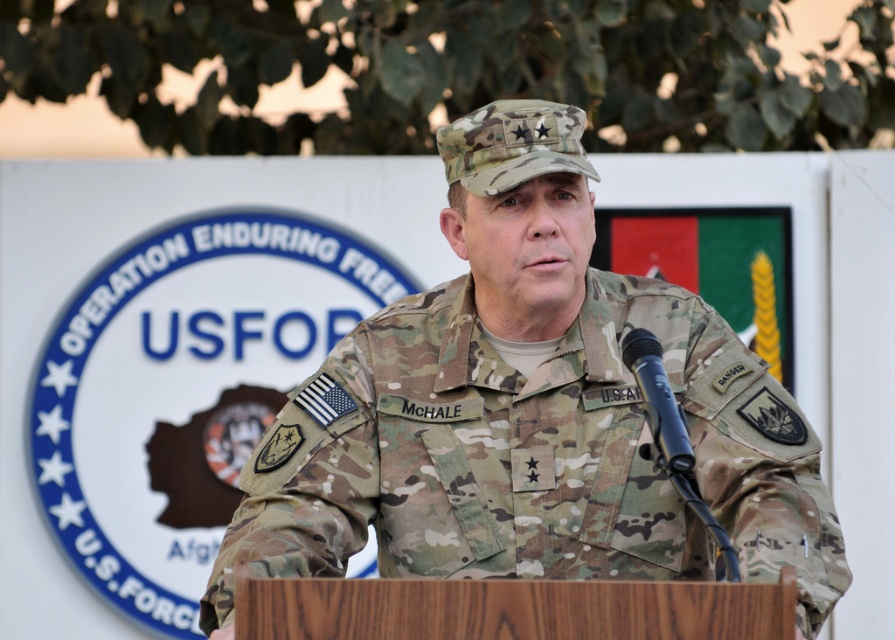
Question: Does camo uniform at center have a larger size compared to black matte microphone at center?

Choices:
 (A) yes
 (B) no

Answer: (A)

Question: Is the position of camo uniform at center more distant than that of black matte microphone at center?

Choices:
 (A) yes
 (B) no

Answer: (A)

Question: Among these objects, which one is nearest to the camera?

Choices:
 (A) camo uniform at center
 (B) black matte microphone at center

Answer: (B)

Question: Among these objects, which one is nearest to the camera?

Choices:
 (A) camo uniform at center
 (B) black matte microphone at center

Answer: (B)

Question: Does camo uniform at center have a greater width compared to black matte microphone at center?

Choices:
 (A) yes
 (B) no

Answer: (A)